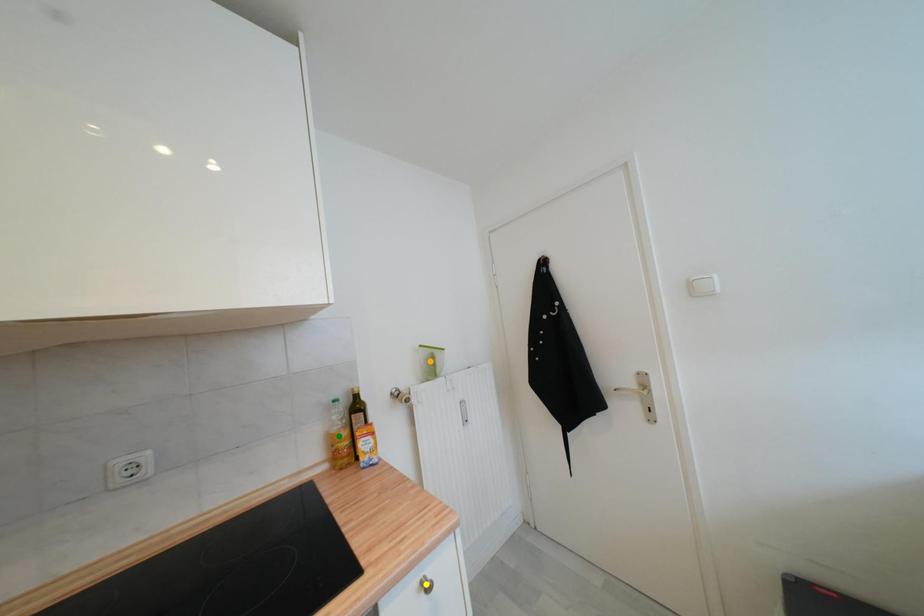
Order these from farthest to nearest:
orange point
yellow point
green point

orange point
green point
yellow point